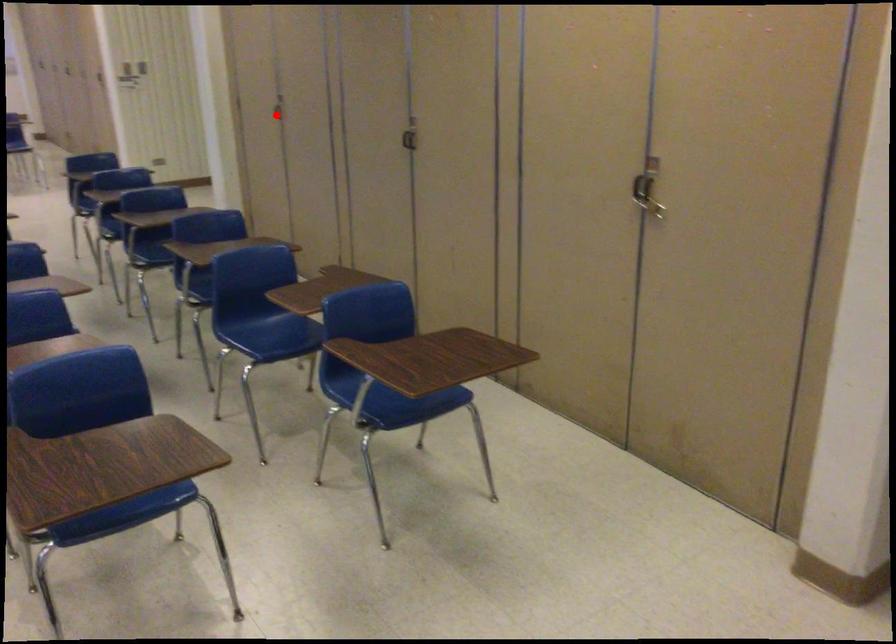
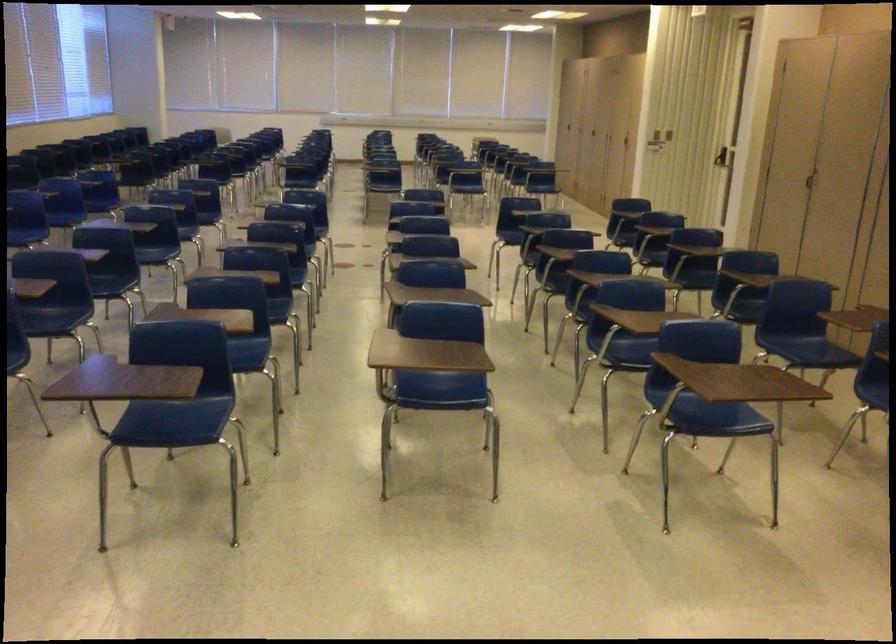
Question: I am providing you with two images of the same scene from different viewpoints. A red point is shown in image1. For the corresponding object point in image2, is it positioned nearer or farther from the camera?

Choices:
 (A) Nearer
 (B) Farther

Answer: (B)